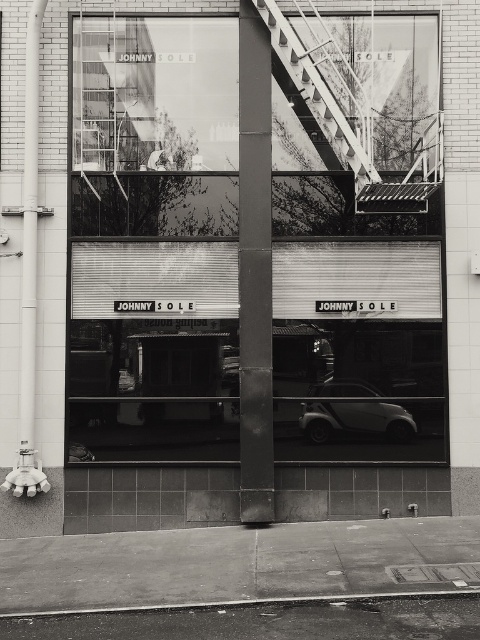
Is white smooth pipe at left positioned in front of smooth concrete curb at lower center?

No, white smooth pipe at left is further to the viewer.

You are a GUI agent. You are given a task and a screenshot of the screen. Output one action in this format:
    pyautogui.click(x=<x>, y=<y>)
    Task: Click on the white smooth pipe at left
    Image resolution: width=480 pixels, height=640 pixels.
    Given the screenshot: What is the action you would take?
    pyautogui.click(x=29, y=253)

Locate an element on the screen. The height and width of the screenshot is (640, 480). white smooth pipe at left is located at coordinates (29, 253).

Based on the photo, does transparent glass window at upper center have a greater height compared to metallic staircase at upper center?

Yes.

Looking at this image, is transparent glass window at upper center wider than metallic staircase at upper center?

Yes, transparent glass window at upper center is wider than metallic staircase at upper center.

Is point (216, 186) positioned behind point (326, 99)?

Yes, it is.

Locate an element on the screen. Image resolution: width=480 pixels, height=640 pixels. transparent glass window at upper center is located at coordinates (155, 125).

How far apart are transparent glass window at upper center and white smooth pipe at left?

They are 4.18 feet apart.

Find the location of a particular element. transparent glass window at upper center is located at coordinates [155, 125].